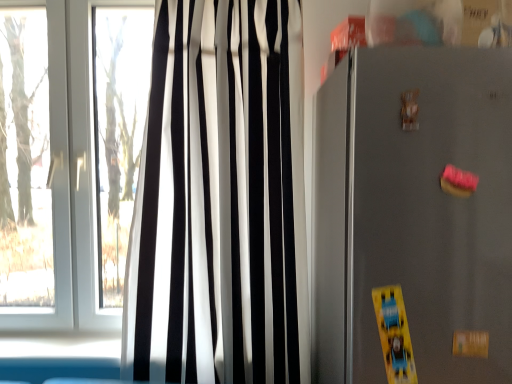
Describe the element at coordinates (220, 200) in the screenshot. The image size is (512, 384). I see `black/white striped curtain at left` at that location.

This screenshot has width=512, height=384. I want to click on black/white striped curtain at left, so click(220, 200).

This screenshot has height=384, width=512. What do you see at coordinates (414, 212) in the screenshot?
I see `satin gray refrigerator at right` at bounding box center [414, 212].

In order to face satin gray refrigerator at right, should I rotate leftwards or rightwards?

Turn right by 22.859 degrees to look at satin gray refrigerator at right.

Where is `satin gray refrigerator at right`? satin gray refrigerator at right is located at coordinates (414, 212).

Locate an element on the screen. black/white striped curtain at left is located at coordinates (220, 200).

Considering the positions of objects black/white striped curtain at left and satin gray refrigerator at right in the image provided, who is more to the left, black/white striped curtain at left or satin gray refrigerator at right?

From the viewer's perspective, black/white striped curtain at left appears more on the left side.

Considering their positions, is black/white striped curtain at left located in front of or behind satin gray refrigerator at right?

Clearly, black/white striped curtain at left is behind satin gray refrigerator at right.

Which is closer, (297, 122) or (372, 185)?

Point (372, 185)

From the image's perspective, would you say black/white striped curtain at left is shown under satin gray refrigerator at right?

Incorrect, from the image's perspective, black/white striped curtain at left is higher than satin gray refrigerator at right.

Consider the image. From a real-world perspective, between black/white striped curtain at left and satin gray refrigerator at right, who is vertically higher?

black/white striped curtain at left is physically above.

Does black/white striped curtain at left have a greater width compared to satin gray refrigerator at right?

No.

Does black/white striped curtain at left have a lesser height compared to satin gray refrigerator at right?

Incorrect, the height of black/white striped curtain at left does not fall short of that of satin gray refrigerator at right.

Is black/white striped curtain at left bigger than satin gray refrigerator at right?

Incorrect, black/white striped curtain at left is not larger than satin gray refrigerator at right.

Choose the correct answer: Is black/white striped curtain at left inside satin gray refrigerator at right or outside it?

black/white striped curtain at left is not inside satin gray refrigerator at right, it's outside.

Is black/white striped curtain at left touching satin gray refrigerator at right?

No, black/white striped curtain at left is not next to satin gray refrigerator at right.

Is black/white striped curtain at left turned away from satin gray refrigerator at right?

That's not correct — black/white striped curtain at left is not looking away from satin gray refrigerator at right.

How different are the orientations of black/white striped curtain at left and satin gray refrigerator at right in degrees?

The angular difference between black/white striped curtain at left and satin gray refrigerator at right is 0.81 degrees.

Measure the distance from black/white striped curtain at left to satin gray refrigerator at right.

black/white striped curtain at left and satin gray refrigerator at right are 21.78 inches apart from each other.

At what (x,y) coordinates should I click in order to perform the action: click on curtain above the satin gray refrigerator at right (from the image's perspective). Please return your answer as a coordinate pair (x, y). Looking at the image, I should click on (220, 200).

Is satin gray refrigerator at right to the left of black/white striped curtain at left from the viewer's perspective?

No.

In the image, is satin gray refrigerator at right positioned in front of or behind black/white striped curtain at left?

In the image, satin gray refrigerator at right appears in front of black/white striped curtain at left.

Is point (483, 234) positioned behind point (263, 38)?

No, (483, 234) is closer to viewer.

From the image's perspective, does satin gray refrigerator at right appear higher than black/white striped curtain at left?

No, from the image's perspective, satin gray refrigerator at right is not on top of black/white striped curtain at left.

From a real-world perspective, is satin gray refrigerator at right over black/white striped curtain at left?

No, from a real-world perspective, satin gray refrigerator at right is not on top of black/white striped curtain at left.

Which object is thinner, satin gray refrigerator at right or black/white striped curtain at left?

With smaller width is black/white striped curtain at left.

In terms of height, does satin gray refrigerator at right look taller or shorter compared to black/white striped curtain at left?

Considering their sizes, satin gray refrigerator at right has less height than black/white striped curtain at left.

Between satin gray refrigerator at right and black/white striped curtain at left, which one has larger size?

With larger size is satin gray refrigerator at right.

Is black/white striped curtain at left surrounded by satin gray refrigerator at right?

No, black/white striped curtain at left is not surrounded by satin gray refrigerator at right.

Is satin gray refrigerator at right directly adjacent to black/white striped curtain at left?

No, satin gray refrigerator at right is not in contact with black/white striped curtain at left.

Is satin gray refrigerator at right aimed at black/white striped curtain at left?

No, satin gray refrigerator at right is not oriented towards black/white striped curtain at left.

This screenshot has width=512, height=384. In order to click on curtain that appears above the satin gray refrigerator at right (from the image's perspective) in this screenshot , I will do tap(220, 200).

Image resolution: width=512 pixels, height=384 pixels. What are the coordinates of `appliance below the black/white striped curtain at left (from a real-world perspective)` in the screenshot? It's located at (414, 212).

The image size is (512, 384). I want to click on appliance below the black/white striped curtain at left (from the image's perspective), so coord(414,212).